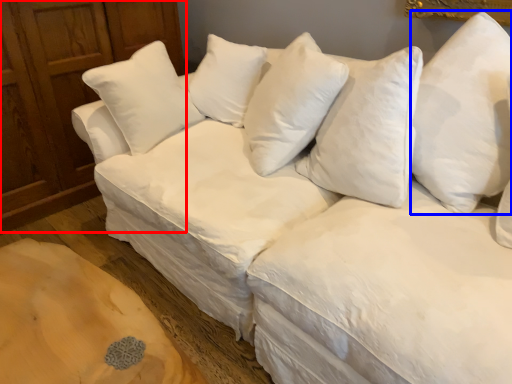
Question: Which object is further to the camera taking this photo, dresser (highlighted by a red box) or pillow (highlighted by a blue box)?

Choices:
 (A) dresser
 (B) pillow

Answer: (A)